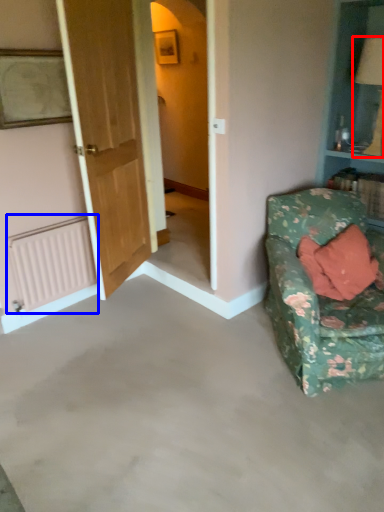
Question: Which point is further to the camera, table lamp (highlighted by a red box) or radiator (highlighted by a blue box)?

Choices:
 (A) table lamp
 (B) radiator

Answer: (B)